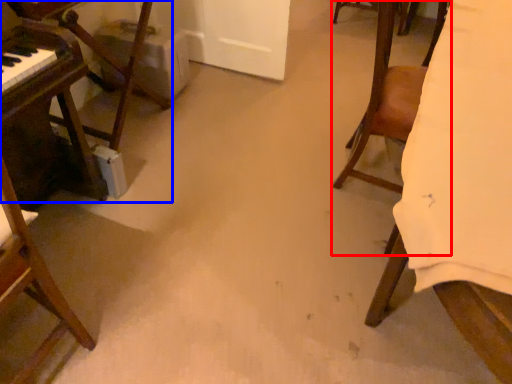
Question: Which object is closer to the camera taking this photo, chair (highlighted by a red box) or furniture (highlighted by a blue box)?

Choices:
 (A) chair
 (B) furniture

Answer: (A)